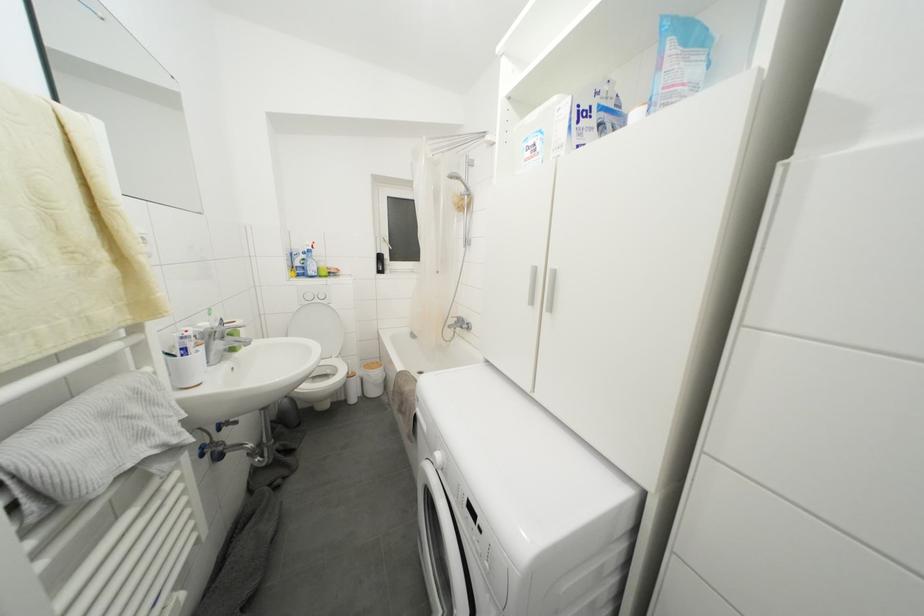
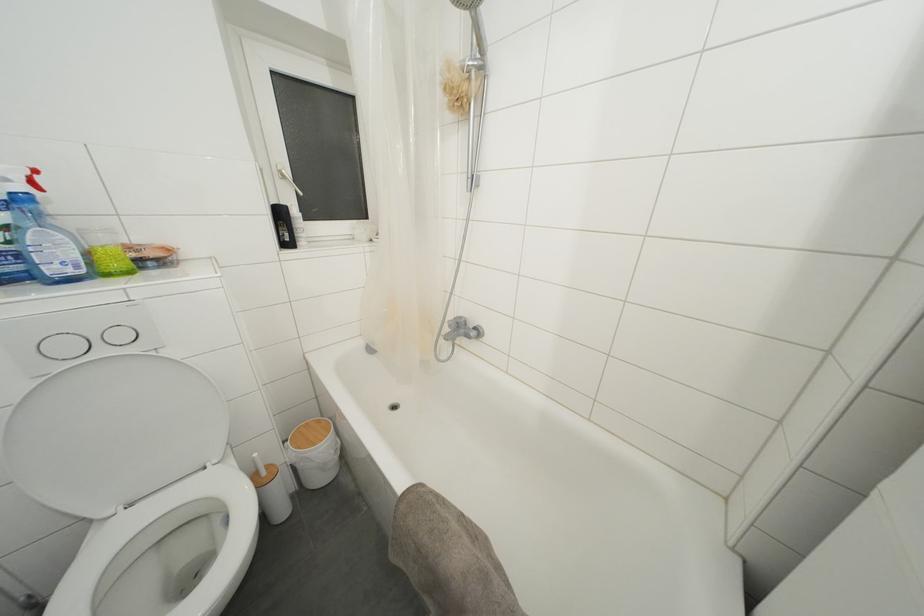
In the second image, find the point that corresponds to the point at 325,270 in the first image.

(108, 245)